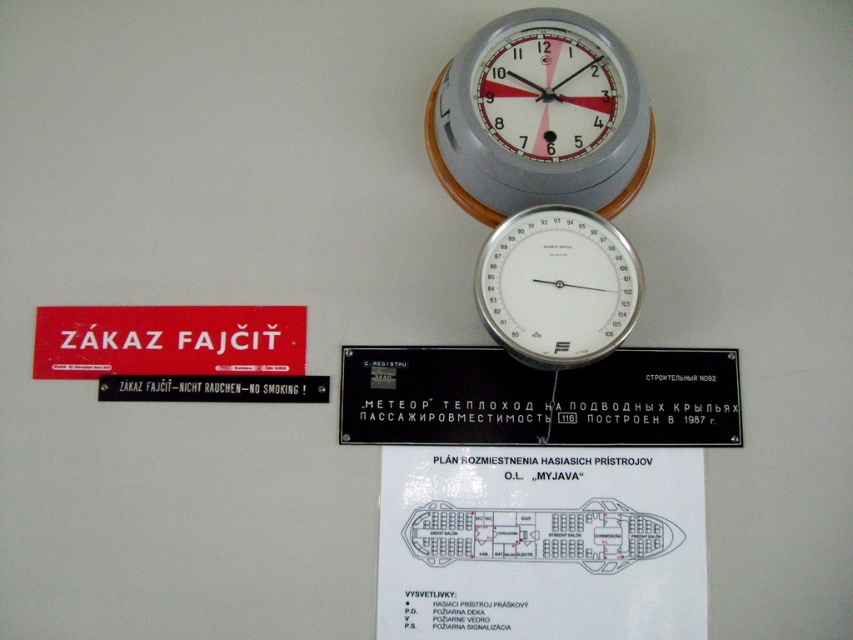
Who is shorter, matte gray clock at upper center or black plastic sign at left?

black plastic sign at left

Is matte gray clock at upper center thinner than black plastic sign at left?

Incorrect, matte gray clock at upper center's width is not less than black plastic sign at left's.

Identify the location of matte gray clock at upper center. This screenshot has height=640, width=853. (538, 116).

Can you confirm if black plastic sign at upper center is wider than black plastic sign at left?

Indeed, black plastic sign at upper center has a greater width compared to black plastic sign at left.

Does black plastic sign at upper center appear under black plastic sign at left?

Yes.

Where is `black plastic sign at upper center`? black plastic sign at upper center is located at coordinates tap(538, 397).

Who is positioned more to the left, white paper at center or black plastic sign at left?

From the viewer's perspective, black plastic sign at left appears more on the left side.

Does white paper at center have a smaller size compared to black plastic sign at left?

No, white paper at center is not smaller than black plastic sign at left.

Between point (579, 564) and point (161, 397), which one is positioned behind?

The point (161, 397) is behind.

Where is `white paper at center`? This screenshot has height=640, width=853. white paper at center is located at coordinates (541, 541).